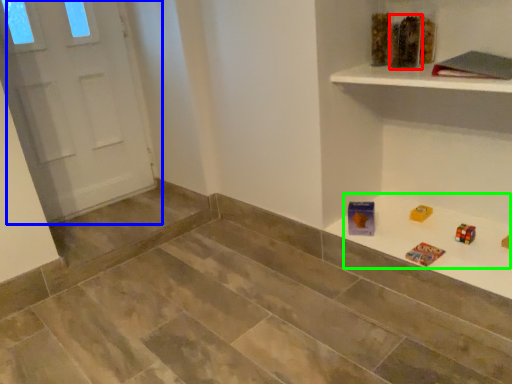
Question: Considering the real-world distances, which object is farthest from toy (highlighted by a red box)? door (highlighted by a blue box) or game (highlighted by a green box)?

Choices:
 (A) door
 (B) game

Answer: (A)